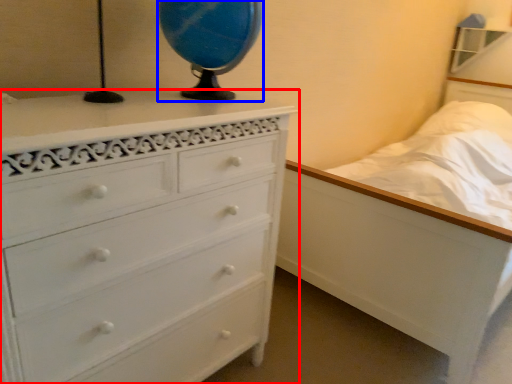
Question: Which object appears closest to the camera in this image, chest of drawers (highlighted by a red box) or table lamp (highlighted by a blue box)?

Choices:
 (A) chest of drawers
 (B) table lamp

Answer: (A)